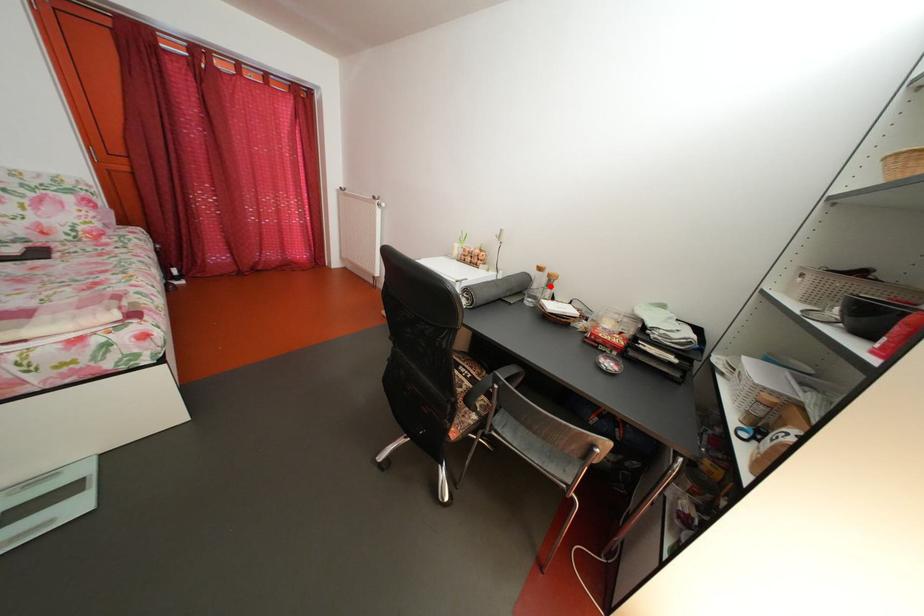
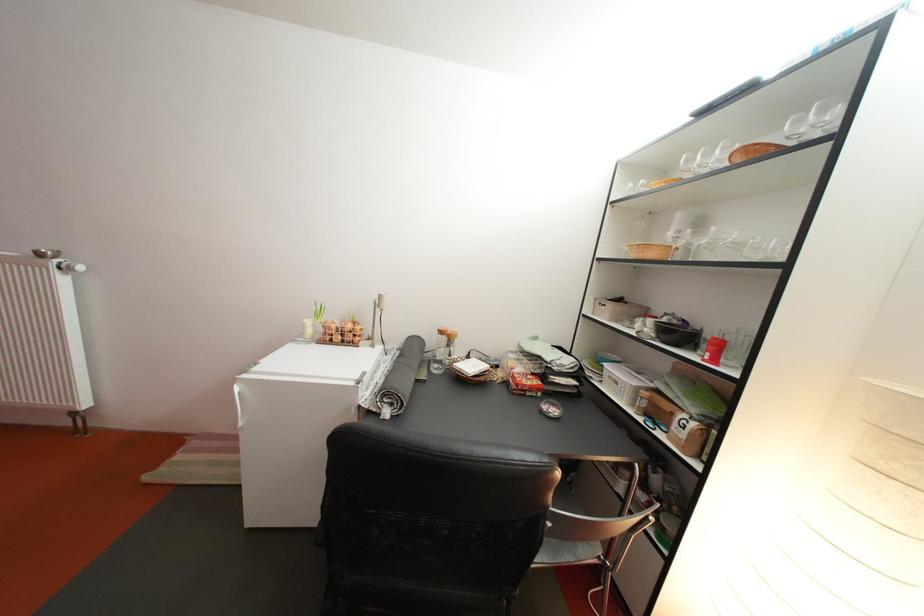
Question: A red point is marked in image1. In image2, is the corresponding 3D point closer to the camera or farther? Reply with the corresponding letter.

Choices:
 (A) The corresponding 3D point is closer.
 (B) The corresponding 3D point is farther.

Answer: (B)